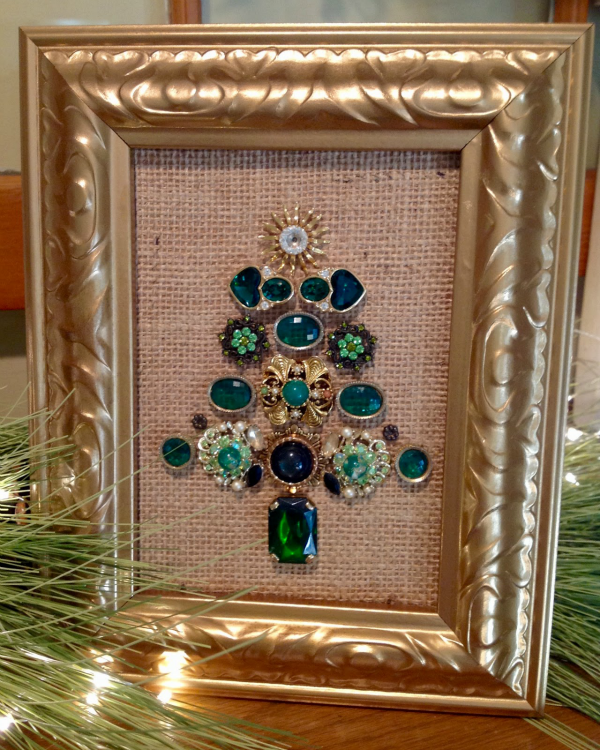
At what (x,y) coordinates should I click in order to perform the action: click on ornately engraved design on inner border of gold picture frame. Please return your answer as a coordinate pair (x, y). Looking at the image, I should click on (105, 70).